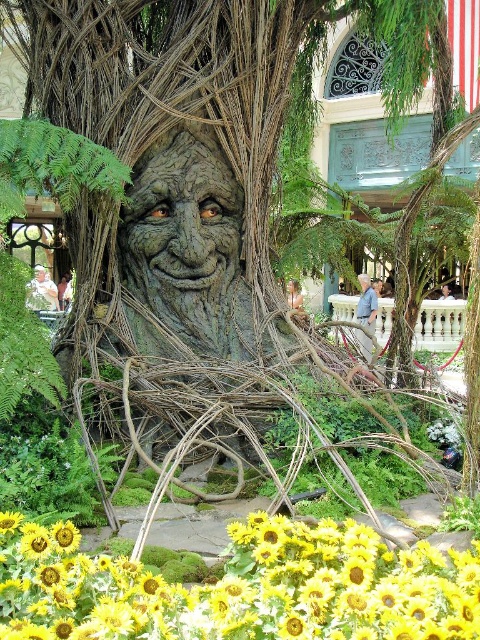
You are standing in front of the large tree with carved face. You see a yellow matte sunflower at center and a green mossy tree trunk at center. Which object is positioned to the right side from your perspective?

The yellow matte sunflower at center is positioned to the right of the green mossy tree trunk at center.

You are a gardener who wants to plant a new flower bed between the yellow matte sunflower at center and the green mossy tree trunk at center. Which object should you dig around to ensure the new plants will have enough space to grow taller than the sunflower?

You should dig around the green mossy tree trunk at center because it is taller than the yellow matte sunflower at center, providing more vertical space for the new plants to grow.

You are a painter standing in front of the scene. You want to paint the yellow matte sunflower at center and the green mossy tree trunk at center. Which object should you paint first to ensure proper layering?

The yellow matte sunflower at center is in front of the green mossy tree trunk at center, so you should paint the yellow matte sunflower at center first to ensure it appears layered correctly on top.